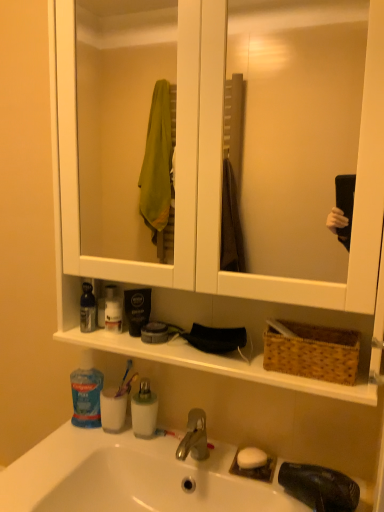
The image size is (384, 512). I want to click on vacant position to the left of white matte soap at sink, so click(x=198, y=458).